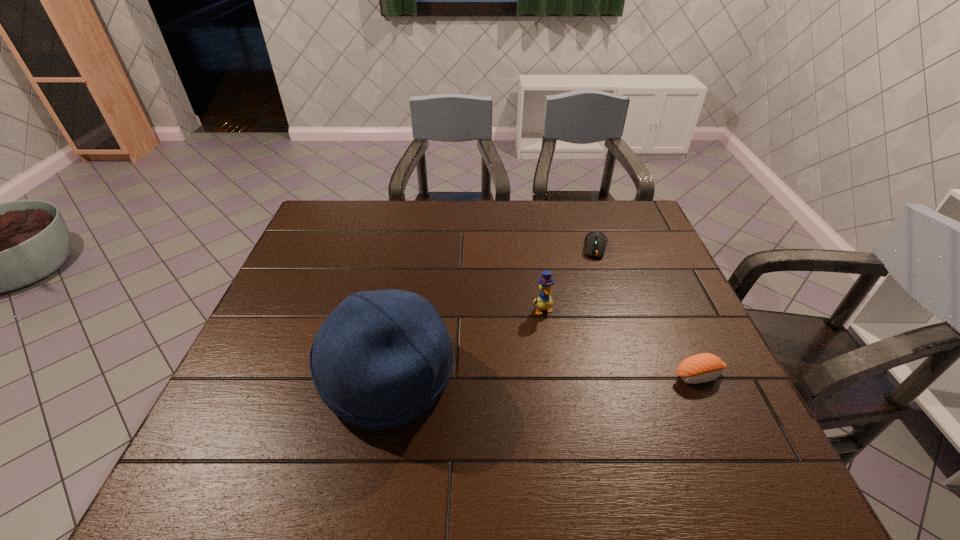
You are a GUI agent. You are given a task and a screenshot of the screen. Output one action in this format:
    pyautogui.click(x=<x>, y=<y>)
    Task: Click on the object located at the far right corner
    This screenshot has width=960, height=540.
    Given the screenshot: What is the action you would take?
    pyautogui.click(x=595, y=242)

Where is `vacant point at the far edge`? vacant point at the far edge is located at coordinates (598, 231).

The height and width of the screenshot is (540, 960). In the image, there is a desktop. What are the coordinates of `vacant space at the near edge` in the screenshot? It's located at (463, 410).

The height and width of the screenshot is (540, 960). Identify the location of vacant space at the left edge of the desktop. (233, 382).

Image resolution: width=960 pixels, height=540 pixels. I want to click on free space at the right edge of the desktop, so click(x=647, y=280).

Where is `free region at the far right corner of the desktop`? free region at the far right corner of the desktop is located at coordinates (628, 205).

Where is `free space that is in between the second object from left to right and the tallest object`? This screenshot has height=540, width=960. free space that is in between the second object from left to right and the tallest object is located at coordinates (466, 343).

The height and width of the screenshot is (540, 960). Find the location of `free space between the tallest object and the sushi`. free space between the tallest object and the sushi is located at coordinates (543, 376).

The height and width of the screenshot is (540, 960). I want to click on unoccupied position between the second tallest object and the sushi, so click(x=621, y=343).

This screenshot has width=960, height=540. I want to click on free space between the computer equipment and the tallest object, so click(x=492, y=312).